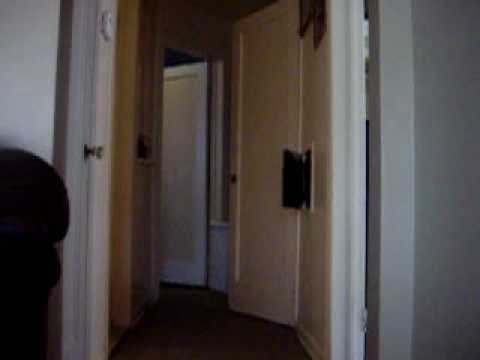
Locate an element on the screen. Image resolution: width=480 pixels, height=360 pixels. wall is located at coordinates (26, 75).